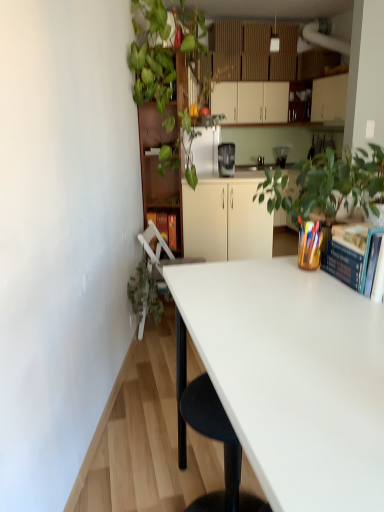
Question: Should I look upward or downward to see matte black coffee maker at center?

Choices:
 (A) down
 (B) up

Answer: (B)

Question: Should I look upward or downward to see white matte cabinet at center, the second cabinetry when ordered from back to front?

Choices:
 (A) down
 (B) up

Answer: (B)

Question: Is blue hardcover book at upper right wider than white glossy desk at center?

Choices:
 (A) yes
 (B) no

Answer: (B)

Question: From the image's perspective, is blue hardcover book at upper right on top of white glossy desk at center?

Choices:
 (A) yes
 (B) no

Answer: (A)

Question: Does blue hardcover book at upper right have a lesser width compared to white glossy desk at center?

Choices:
 (A) yes
 (B) no

Answer: (A)

Question: Is blue hardcover book at upper right positioned with its back to white glossy desk at center?

Choices:
 (A) yes
 (B) no

Answer: (B)

Question: From a real-world perspective, is blue hardcover book at upper right physically above white glossy desk at center?

Choices:
 (A) no
 (B) yes

Answer: (B)

Question: Is blue hardcover book at upper right far away from white glossy desk at center?

Choices:
 (A) no
 (B) yes

Answer: (A)

Question: Is green leafy plant at upper left, the 2th vegetation from the bottom, positioned with its back to white plastic chair at lower left?

Choices:
 (A) yes
 (B) no

Answer: (B)

Question: Considering the relative sizes of green leafy plant at upper left, the 2th vegetation from the bottom, and white plastic chair at lower left in the image provided, is green leafy plant at upper left, the 2th vegetation from the bottom, thinner than white plastic chair at lower left?

Choices:
 (A) yes
 (B) no

Answer: (B)

Question: From a real-world perspective, is green leafy plant at upper left, the 2th vegetation from the bottom, beneath white plastic chair at lower left?

Choices:
 (A) yes
 (B) no

Answer: (B)

Question: Is green leafy plant at upper left, arranged as the 1th vegetation when viewed from the top, next to white plastic chair at lower left and touching it?

Choices:
 (A) no
 (B) yes

Answer: (A)

Question: Is green leafy plant at upper left, arranged as the 1th vegetation when viewed from the top, positioned far away from white plastic chair at lower left?

Choices:
 (A) yes
 (B) no

Answer: (B)

Question: Considering the relative sizes of green leafy plant at upper left, the 2th vegetation from the bottom, and white plastic chair at lower left in the image provided, is green leafy plant at upper left, the 2th vegetation from the bottom, bigger than white plastic chair at lower left?

Choices:
 (A) yes
 (B) no

Answer: (A)

Question: Is matte black coffee maker at center behind satin black coffee maker at center?

Choices:
 (A) no
 (B) yes

Answer: (B)